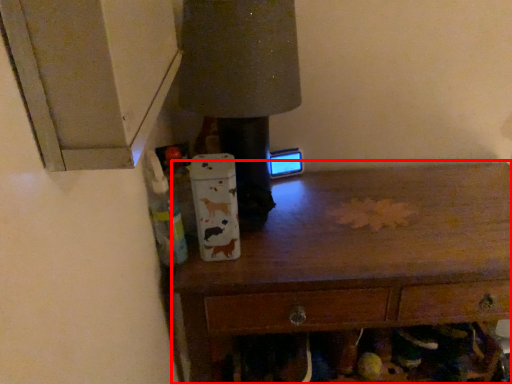
Question: From the image's perspective, where is chest of drawers (annotated by the red box) located relative to bottle?

Choices:
 (A) above
 (B) below

Answer: (B)